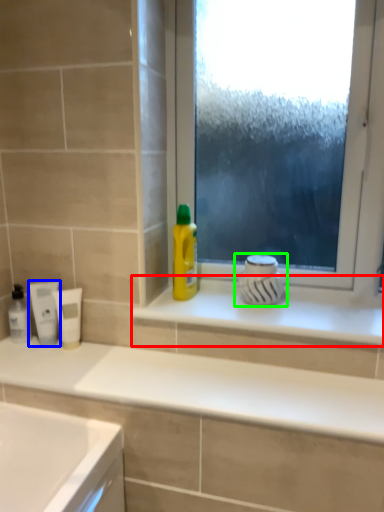
Question: Based on their relative distances, which object is farther from window sill (highlighted by a red box)? Choose from mouthwash (highlighted by a blue box) and appliance (highlighted by a green box).

Choices:
 (A) mouthwash
 (B) appliance

Answer: (A)